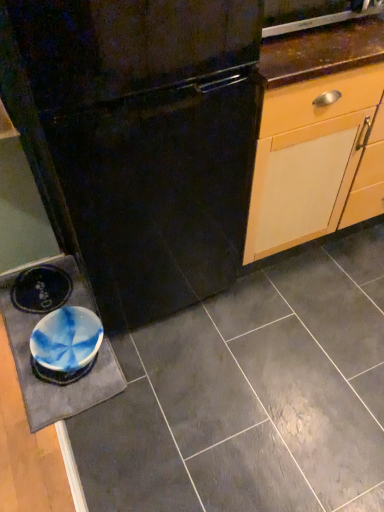
I want to click on vacant area located to the right-hand side of blue marbled slate at lower left, so click(182, 367).